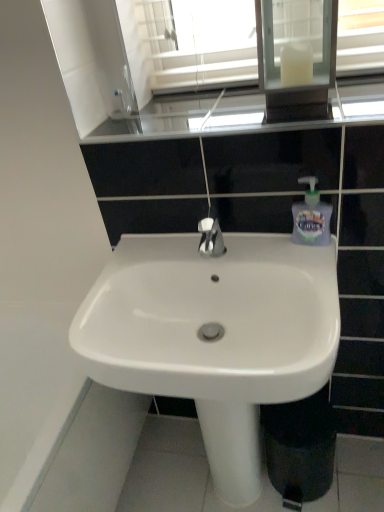
Question: Are white glossy sink at center and translucent plastic soap dispenser at right making contact?

Choices:
 (A) no
 (B) yes

Answer: (A)

Question: From the image's perspective, does white glossy sink at center appear lower than translucent plastic soap dispenser at right?

Choices:
 (A) no
 (B) yes

Answer: (B)

Question: Is white glossy sink at center to the left of translucent plastic soap dispenser at right from the viewer's perspective?

Choices:
 (A) no
 (B) yes

Answer: (B)

Question: Does white glossy sink at center have a lesser height compared to translucent plastic soap dispenser at right?

Choices:
 (A) no
 (B) yes

Answer: (A)

Question: Can you confirm if white glossy sink at center is smaller than translucent plastic soap dispenser at right?

Choices:
 (A) yes
 (B) no

Answer: (B)

Question: Does white glossy sink at center turn towards translucent plastic soap dispenser at right?

Choices:
 (A) yes
 (B) no

Answer: (B)

Question: Does white glossy sink at center have a lesser height compared to white glass medicine cabinet at upper center?

Choices:
 (A) no
 (B) yes

Answer: (B)

Question: Is white glossy sink at center aimed at white glass medicine cabinet at upper center?

Choices:
 (A) no
 (B) yes

Answer: (A)

Question: From the image's perspective, is white glossy sink at center below white glass medicine cabinet at upper center?

Choices:
 (A) no
 (B) yes

Answer: (B)

Question: Is white glossy sink at center thinner than white glass medicine cabinet at upper center?

Choices:
 (A) no
 (B) yes

Answer: (A)

Question: Is white glass medicine cabinet at upper center inside white glossy sink at center?

Choices:
 (A) no
 (B) yes

Answer: (A)

Question: Is white glossy sink at center directly adjacent to white glass medicine cabinet at upper center?

Choices:
 (A) yes
 (B) no

Answer: (B)

Question: Is white glass medicine cabinet at upper center behind glossy glass window sill at upper center?

Choices:
 (A) yes
 (B) no

Answer: (B)